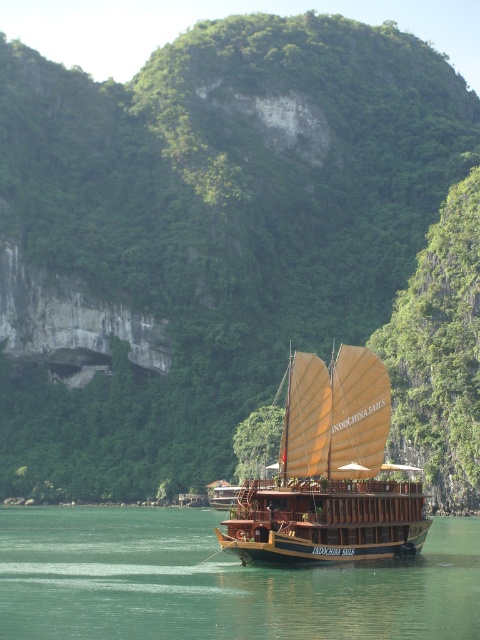
Between point (394, 595) and point (336, 508), which one is positioned behind?

Positioned behind is point (336, 508).

Identify the location of green water at boat right. (217, 580).